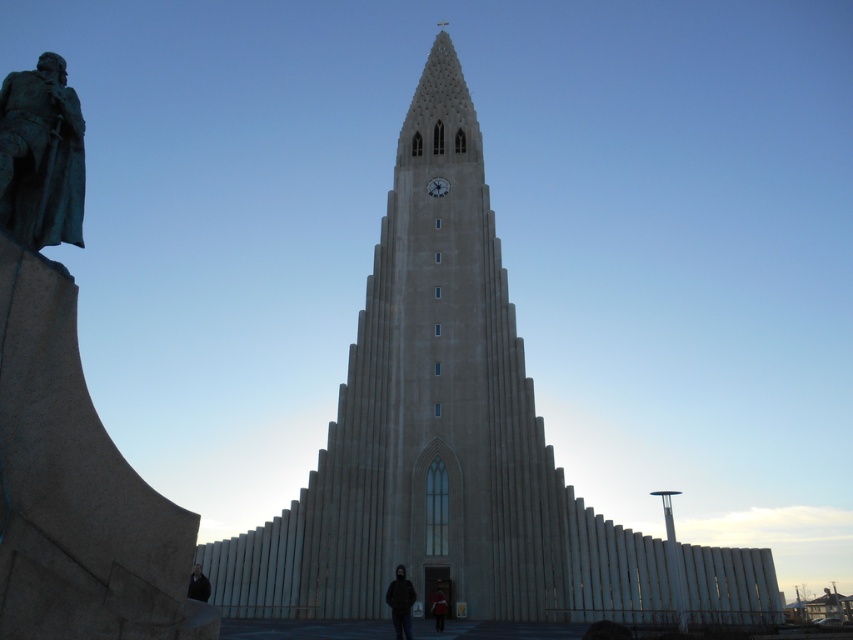
Question: Which of the following is the farthest from the observer?

Choices:
 (A) white stone clock at center
 (B) bronze statue at left
 (C) dark brown leather jacket at lower center
 (D) green patina stone statue at left

Answer: (A)

Question: Which object is the farthest from the white stone clock at center?

Choices:
 (A) bronze statue at left
 (B) dark brown leather jacket at lower center
 (C) dark clothing at center

Answer: (B)

Question: Does bronze statue at left appear on the right side of dark clothing at center?

Choices:
 (A) yes
 (B) no

Answer: (B)

Question: Which point is farther from the camera taking this photo?

Choices:
 (A) (354, 515)
 (B) (61, 346)
 (C) (401, 570)
 (D) (196, 595)

Answer: (A)

Question: Is bronze statue at left smaller than dark brown leather jacket at lower center?

Choices:
 (A) no
 (B) yes

Answer: (B)

Question: Does bronze statue at left come behind black matte jacket at lower center?

Choices:
 (A) yes
 (B) no

Answer: (B)